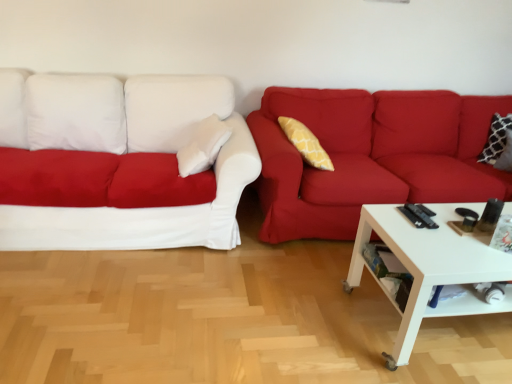
Locate an element on the screen. free space to the left of white glossy coffee table at lower right is located at coordinates (297, 304).